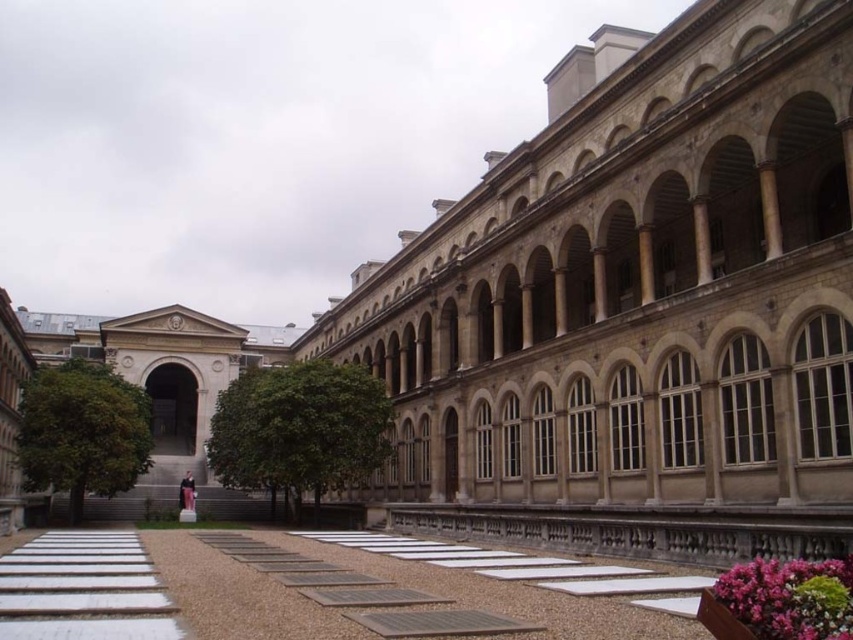
Question: Does gray gravel at center have a larger size compared to white concrete path at lower left?

Choices:
 (A) yes
 (B) no

Answer: (A)

Question: Which of the following is the farthest from the observer?

Choices:
 (A) pink textured flowers at lower right
 (B) beige stone palace at center

Answer: (B)

Question: Is beige stone palace at center thinner than pink textured flowers at lower right?

Choices:
 (A) no
 (B) yes

Answer: (A)

Question: Does gray gravel at center have a larger size compared to pink textured flowers at lower right?

Choices:
 (A) yes
 (B) no

Answer: (A)

Question: Which object is the closest to the gray gravel at center?

Choices:
 (A) pink textured flowers at lower right
 (B) white concrete path at lower left

Answer: (B)

Question: Which point is closer to the camera?

Choices:
 (A) beige stone palace at center
 (B) pink textured flowers at lower right

Answer: (B)